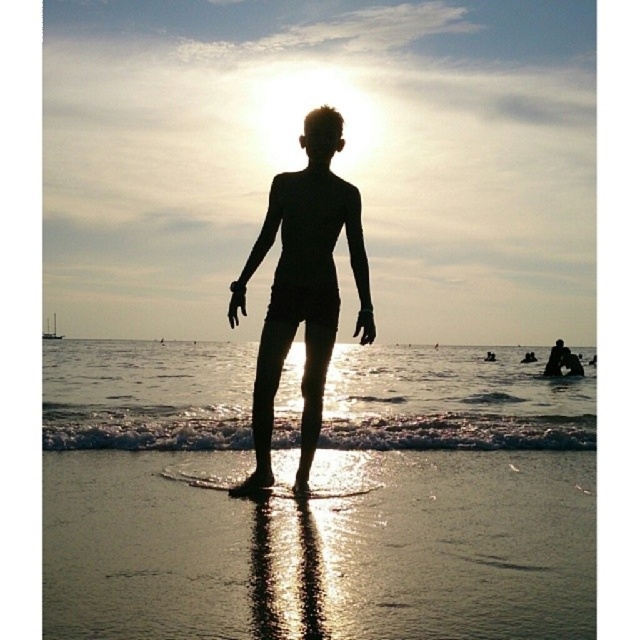
Which of these two, translucent wet sand at lower center or black matte figure at center, stands taller?

With more height is black matte figure at center.

Is translucent wet sand at lower center shorter than black matte figure at center?

Correct, translucent wet sand at lower center is not as tall as black matte figure at center.

Who is more forward, (122,433) or (284,198)?

Point (284,198)

The image size is (640, 640). Identify the location of translucent wet sand at lower center. (451, 401).

Is shiny sand at lower center to the left of transparent plastic surfboard at center from the viewer's perspective?

Incorrect, shiny sand at lower center is not on the left side of transparent plastic surfboard at center.

In the scene shown: Between shiny sand at lower center and transparent plastic surfboard at center, which one appears on the right side from the viewer's perspective?

shiny sand at lower center is more to the right.

Image resolution: width=640 pixels, height=640 pixels. Find the location of `shiny sand at lower center`. shiny sand at lower center is located at coordinates (321, 548).

Is shiny sand at lower center above translucent wet sand at lower center?

Correct, shiny sand at lower center is located above translucent wet sand at lower center.

Identify the location of shiny sand at lower center. Image resolution: width=640 pixels, height=640 pixels. (321, 548).